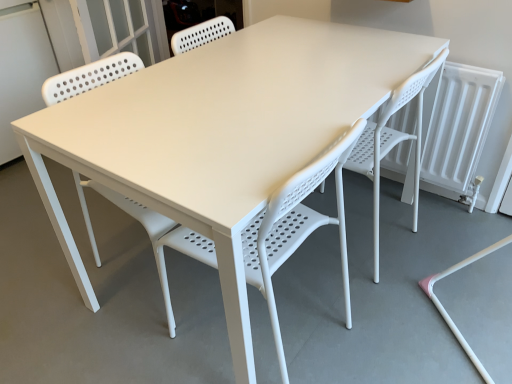
You are a GUI agent. You are given a task and a screenshot of the screen. Output one action in this format:
    pyautogui.click(x=<x>, y=<y>)
    Task: Click on the vacant region under white plastic chair at center, the 1th chair positioned from the left (from a real-world perspective)
    This screenshot has height=384, width=512.
    Given the screenshot: What is the action you would take?
    pyautogui.click(x=282, y=332)